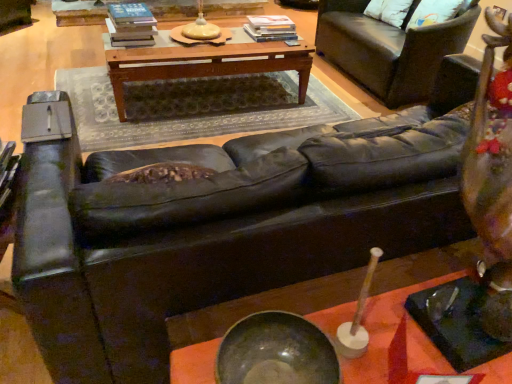
Question: From a real-world perspective, is metallic bowl at center, placed as the 2th table when sorted from back to front, under dark brown leather mat at center?

Choices:
 (A) yes
 (B) no

Answer: (B)

Question: Is metallic bowl at center, the 2th table when ordered from top to bottom, wider than dark brown leather mat at center?

Choices:
 (A) no
 (B) yes

Answer: (A)

Question: Can you confirm if metallic bowl at center, the 2th table when ordered from top to bottom, is positioned to the right of dark brown leather mat at center?

Choices:
 (A) no
 (B) yes

Answer: (B)

Question: From a real-world perspective, is metallic bowl at center, the 2th table when ordered from top to bottom, on top of dark brown leather mat at center?

Choices:
 (A) no
 (B) yes

Answer: (B)

Question: Would you say dark brown leather mat at center is part of metallic bowl at center, placed as the first table when sorted from front to back,'s contents?

Choices:
 (A) yes
 (B) no

Answer: (B)

Question: From a real-world perspective, is white soft pillow at upper right physically located above or below dark brown leather mat at center?

Choices:
 (A) above
 (B) below

Answer: (A)

Question: Looking at their shapes, would you say white soft pillow at upper right is wider or thinner than dark brown leather mat at center?

Choices:
 (A) wide
 (B) thin

Answer: (B)

Question: From the image's perspective, relative to dark brown leather mat at center, is white soft pillow at upper right above or below?

Choices:
 (A) below
 (B) above

Answer: (B)

Question: Is white soft pillow at upper right bigger or smaller than dark brown leather mat at center?

Choices:
 (A) small
 (B) big

Answer: (A)

Question: Considering the relative positions of shiny metallic bowl at center and metallic bowl at center, the first table ordered from the bottom, in the image provided, is shiny metallic bowl at center to the left or to the right of metallic bowl at center, the first table ordered from the bottom,?

Choices:
 (A) left
 (B) right

Answer: (A)

Question: Considering the positions of point (233, 359) and point (507, 357), is point (233, 359) closer or farther from the camera than point (507, 357)?

Choices:
 (A) farther
 (B) closer

Answer: (B)

Question: From a real-world perspective, is shiny metallic bowl at center physically located above or below metallic bowl at center, the 2th table when ordered from top to bottom?

Choices:
 (A) below
 (B) above

Answer: (B)

Question: Is shiny metallic bowl at center bigger or smaller than metallic bowl at center, the 2th table when ordered from top to bottom?

Choices:
 (A) small
 (B) big

Answer: (A)

Question: Relative to woodenobject at center, which is the first table in back-to-front order, is metallic bowl at center, placed as the first table when sorted from front to back, in front or behind?

Choices:
 (A) behind
 (B) front

Answer: (B)

Question: Is metallic bowl at center, the first table ordered from the bottom, taller or shorter than woodenobject at center, the first table in the top-to-bottom sequence?

Choices:
 (A) tall
 (B) short

Answer: (A)